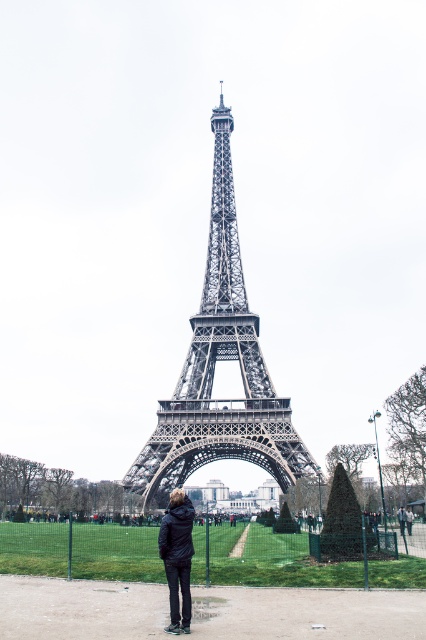
Question: Is metallic structure at center smaller than green grass at lower center?

Choices:
 (A) yes
 (B) no

Answer: (B)

Question: Does green grass at lower center have a smaller size compared to black matte jacket at lower center?

Choices:
 (A) no
 (B) yes

Answer: (A)

Question: Is metallic structure at center smaller than green grass at lower center?

Choices:
 (A) no
 (B) yes

Answer: (A)

Question: Estimate the real-world distances between objects in this image. Which object is farther from the black matte jacket at lower center?

Choices:
 (A) green grass at lower center
 (B) metallic structure at center

Answer: (B)

Question: Which point is closer to the camera taking this photo?

Choices:
 (A) (88, 525)
 (B) (169, 506)

Answer: (B)

Question: Considering the real-world distances, which object is farthest from the metallic structure at center?

Choices:
 (A) black matte jacket at lower center
 (B) green grass at lower center

Answer: (B)